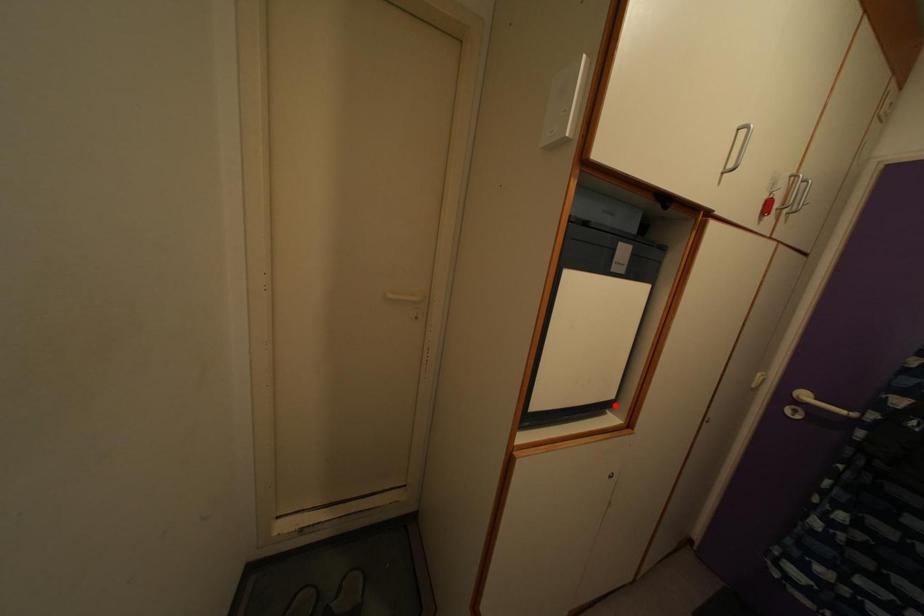
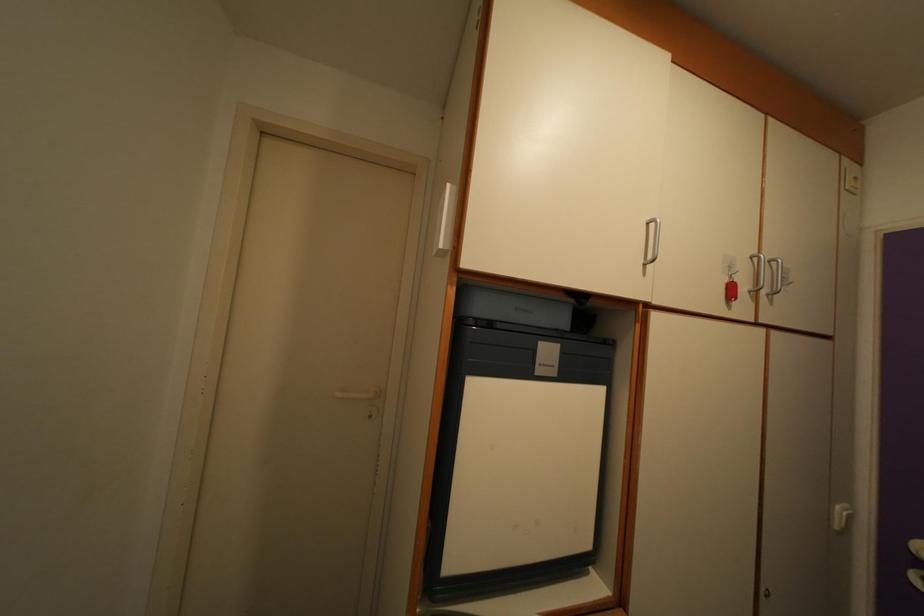
Locate, in the second image, the point that corresponds to the highlighted location in the first image.

(591, 554)